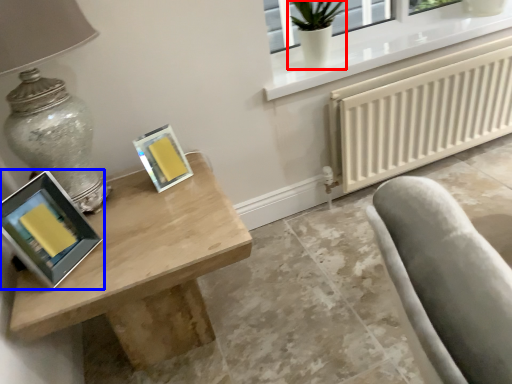
Question: Which object appears closest to the camera in this image, glass vase (highlighted by a red box) or picture frame (highlighted by a blue box)?

Choices:
 (A) glass vase
 (B) picture frame

Answer: (B)